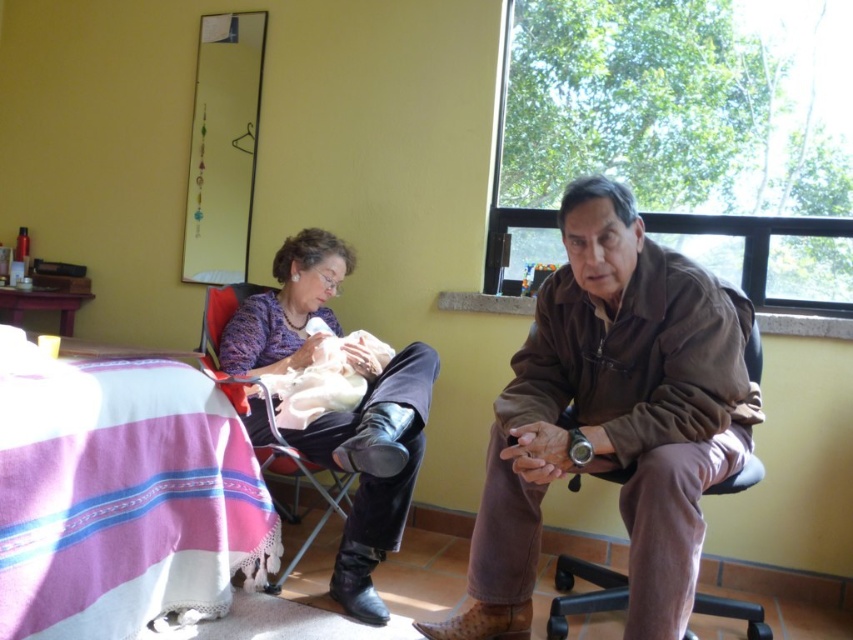
Question: Which object is positioned farthest from the velvet-like red armchair at left?

Choices:
 (A) brown suede jacket at center
 (B) soft white baby at center
 (C) brown leather armchair at center
 (D) matte black boots at lower left

Answer: (C)

Question: Is the position of pink striped fabric at lower left less distant than that of velvet-like red armchair at left?

Choices:
 (A) yes
 (B) no

Answer: (A)

Question: Which object is farther from the camera taking this photo?

Choices:
 (A) pink striped fabric at lower left
 (B) velvet-like red armchair at left
 (C) brown suede jacket at center

Answer: (B)

Question: Is brown suede jacket at center smaller than pink striped fabric at lower left?

Choices:
 (A) yes
 (B) no

Answer: (B)

Question: Can you confirm if pink striped fabric at lower left is positioned below velvet-like red armchair at left?

Choices:
 (A) yes
 (B) no

Answer: (A)

Question: Which object is closer to the camera taking this photo?

Choices:
 (A) brown suede jacket at center
 (B) pink striped fabric at lower left
 (C) matte black boots at lower left

Answer: (B)